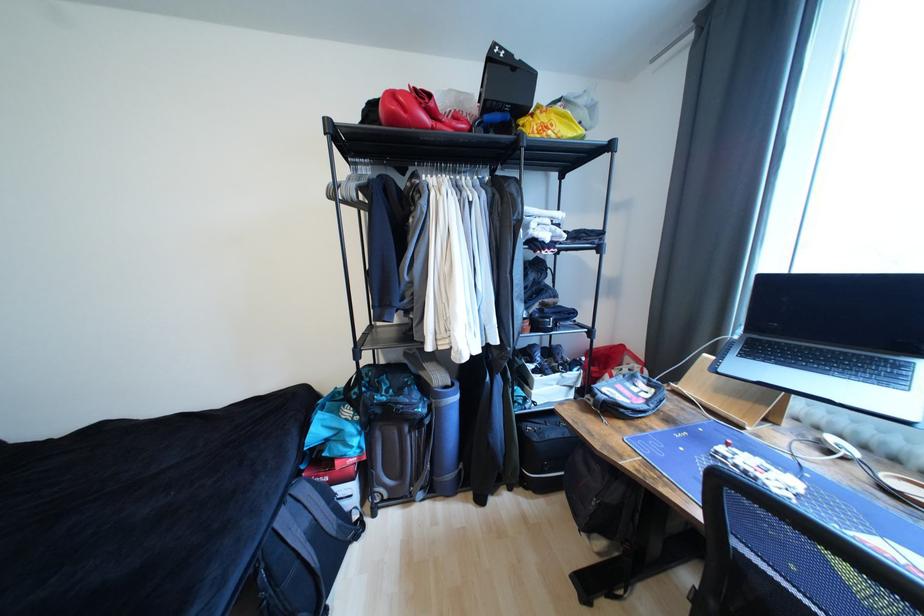
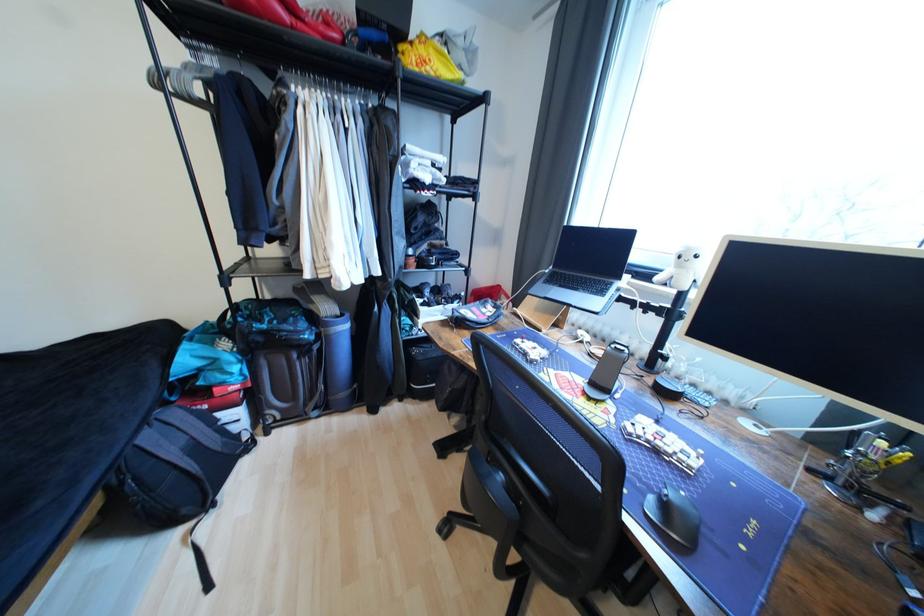
What movement of the cameraman would produce the second image?

The movement direction of the cameraman is right, backward.